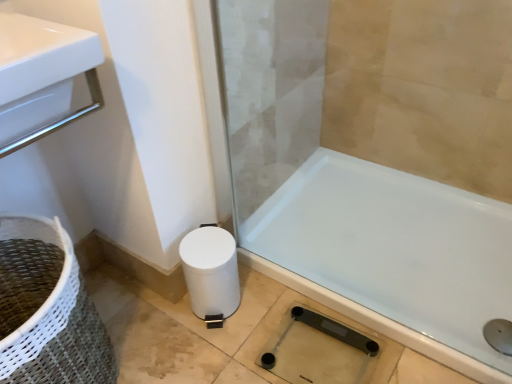
Where is `free spot to the right of transparent glass screen door at lower center`? free spot to the right of transparent glass screen door at lower center is located at coordinates (357, 207).